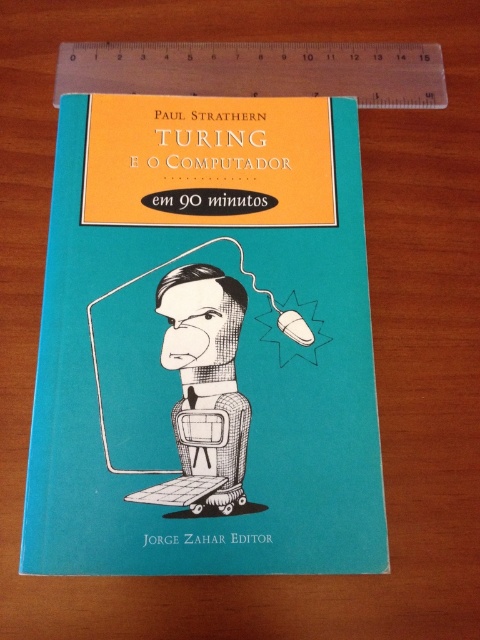
You are an artist trying to draw the scene from the book cover. You need to place the transparent plastic ruler at top and the black textured robot at center. According to the image, which object should you draw first to ensure proper layering?

The transparent plastic ruler at top should be drawn first because it is above the black textured robot at center, so it needs to be placed on top of the robot in the drawing.

You are an artist trying to draw the book cover. You need to place two points on the cover to mark important elements. The first point is at position point (208, 186) and the second point is at point (194, 412). According to the book cover layout, which point is closer to the viewer?

Point (194, 412) is closer to the viewer because the description states that point (208, 186) is behind point (194, 412).

You are holding the teal matte book cover at center and want to place a transparent plastic ruler at top on top of it. Will the ruler be visible from above the book?

The teal matte book cover at center is closer to the viewer than the transparent plastic ruler at top, so the ruler is placed behind the book. Therefore, the transparent plastic ruler at top will not be visible from above the book since it is obscured by the book cover.